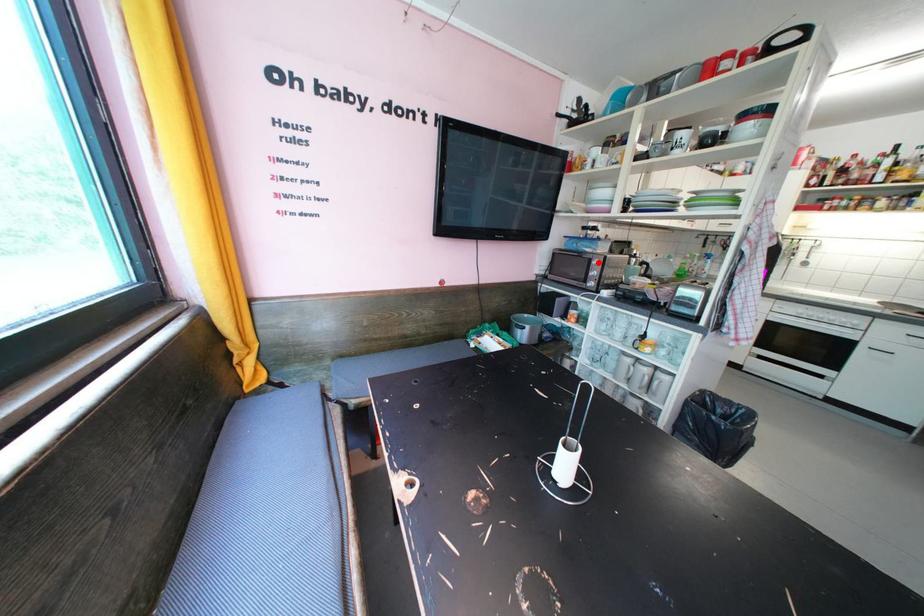
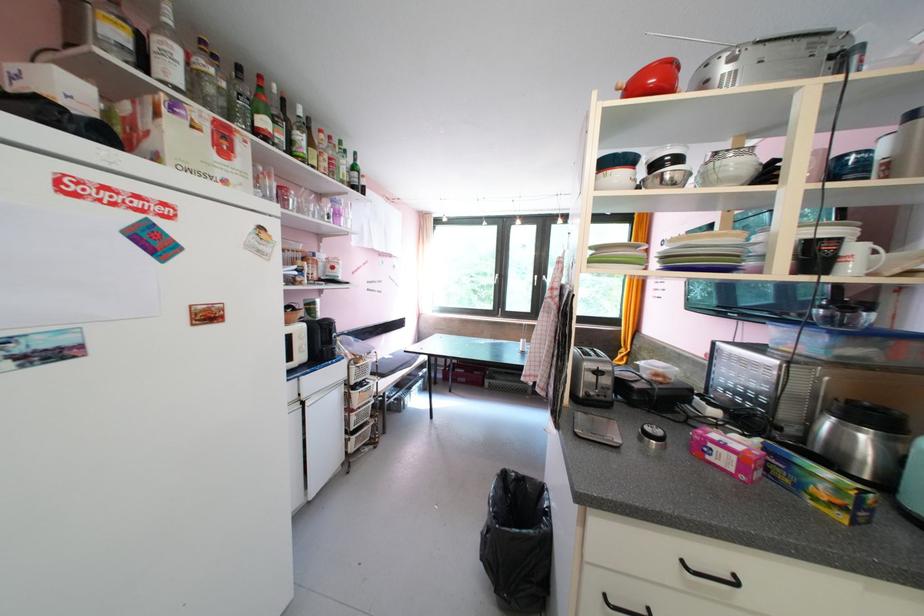
Question: I am providing you with two images of the same scene from different viewpoints. A red point is marked on the first image. At the location where the point appears in image 1, is it still visible in image 2?

Choices:
 (A) Yes
 (B) No

Answer: (B)